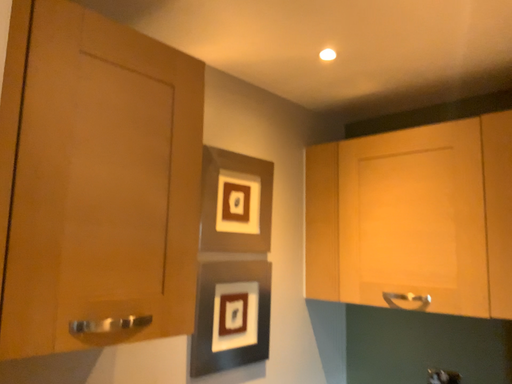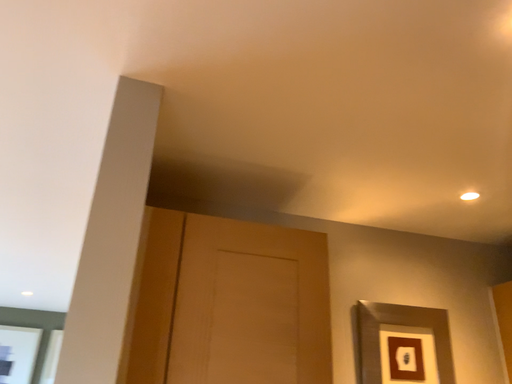
Question: Which way did the camera rotate in the video?

Choices:
 (A) rotated downward
 (B) rotated upward

Answer: (B)